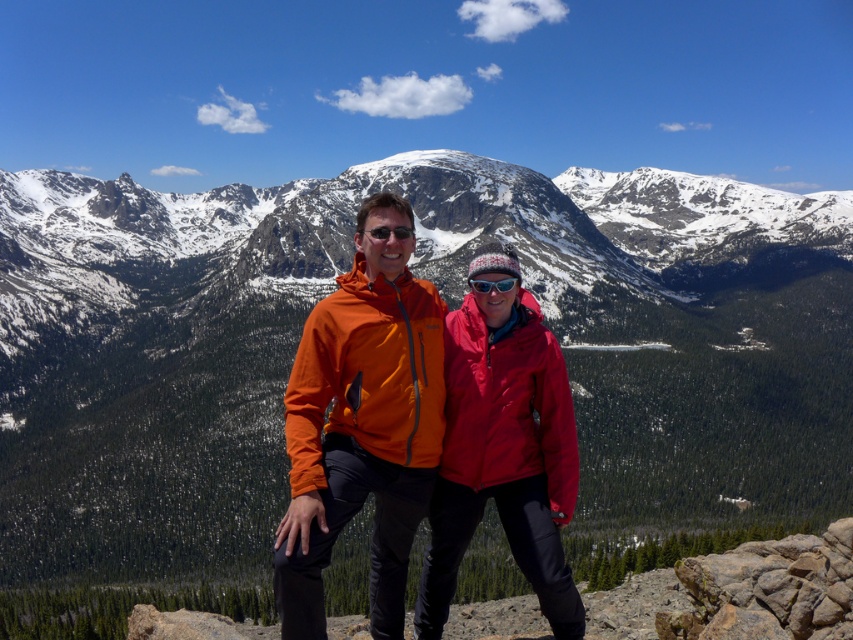
Measure the distance between point (467,397) and camera.

The distance of point (467,397) from camera is 93.54 meters.

Find the location of a particular element. Image resolution: width=853 pixels, height=640 pixels. matte red jacket at center is located at coordinates (503, 448).

Between point (579, 600) and point (495, 282), which one is positioned behind?

Positioned behind is point (495, 282).

The image size is (853, 640). In order to click on matte red jacket at center in this screenshot , I will do `click(503, 448)`.

Is snowy granite mountain at center in front of matte black goggles at center?

No, snowy granite mountain at center is further to the viewer.

Can you confirm if snowy granite mountain at center is wider than matte black goggles at center?

Correct, the width of snowy granite mountain at center exceeds that of matte black goggles at center.

Where is `snowy granite mountain at center`? snowy granite mountain at center is located at coordinates (448, 307).

Measure the distance between point (753, 284) and camera.

Point (753, 284) and camera are 281.39 meters apart.

Find the location of a particular element. The width and height of the screenshot is (853, 640). snowy granite mountain at center is located at coordinates (448, 307).